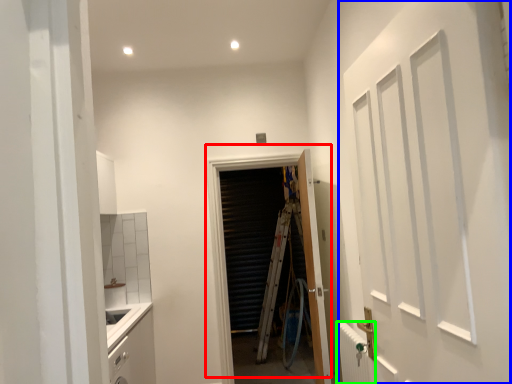
Question: Which is nearer to the door (highlighted by a red box)? door (highlighted by a blue box) or radiator (highlighted by a green box).

Choices:
 (A) door
 (B) radiator

Answer: (B)